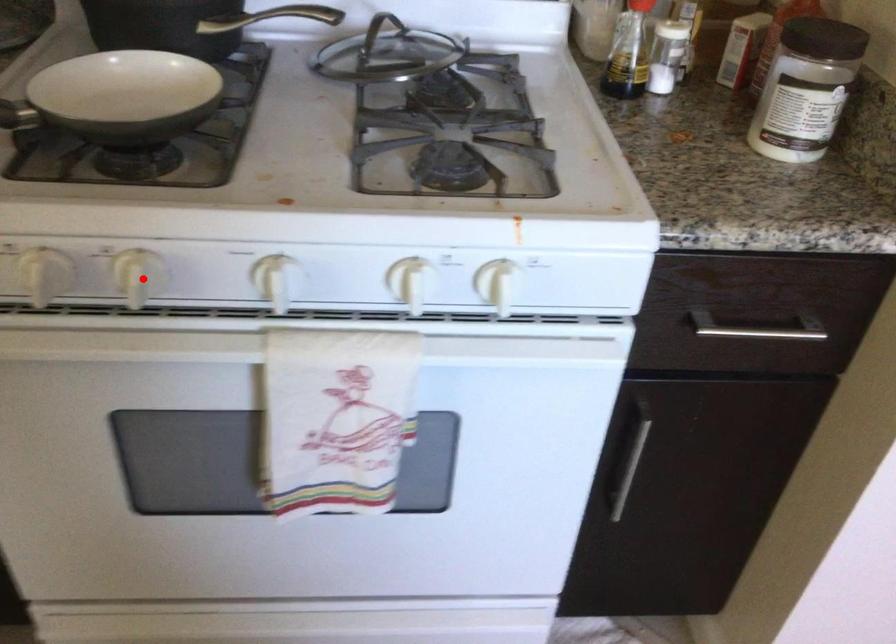
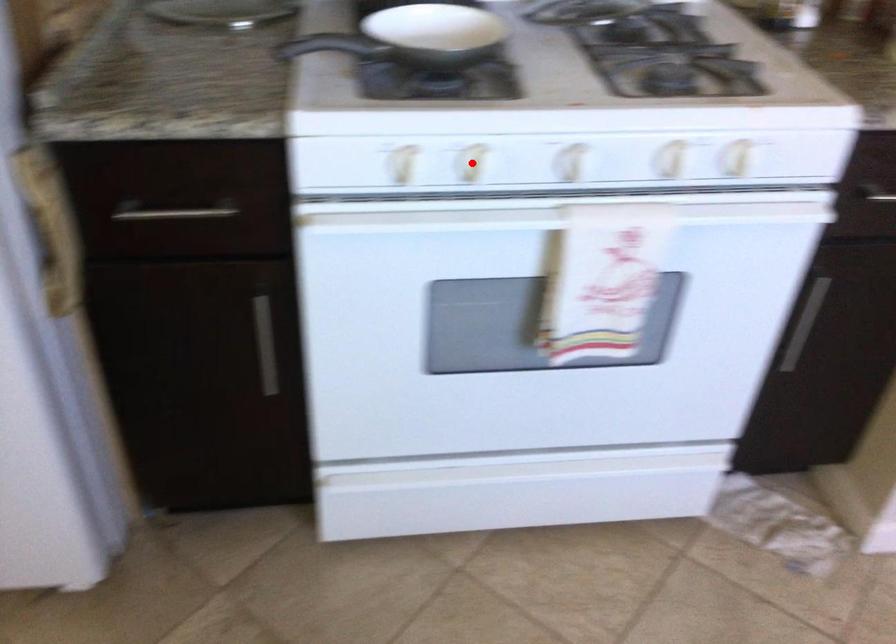
I am providing you with two images of the same scene from different viewpoints. A red point is marked on the first image and another point is marked on the second image. Do the highlighted points in image1 and image2 indicate the same real-world spot?

Yes